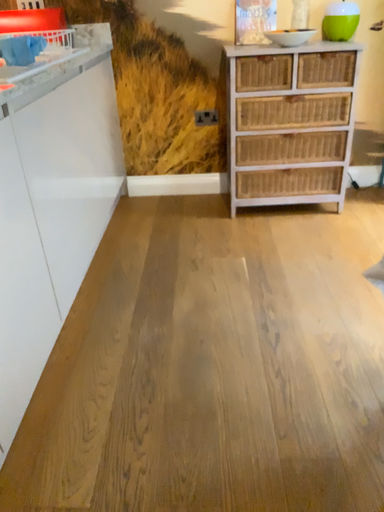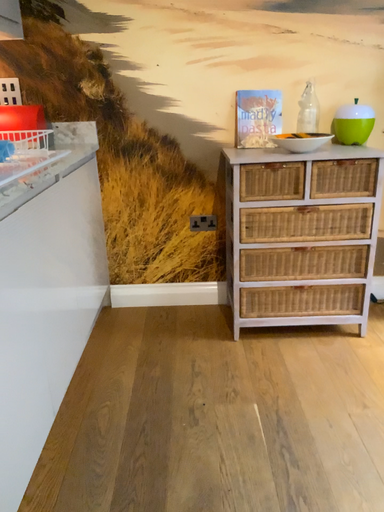
Question: Which way did the camera rotate in the video?

Choices:
 (A) rotated downward
 (B) rotated upward

Answer: (B)